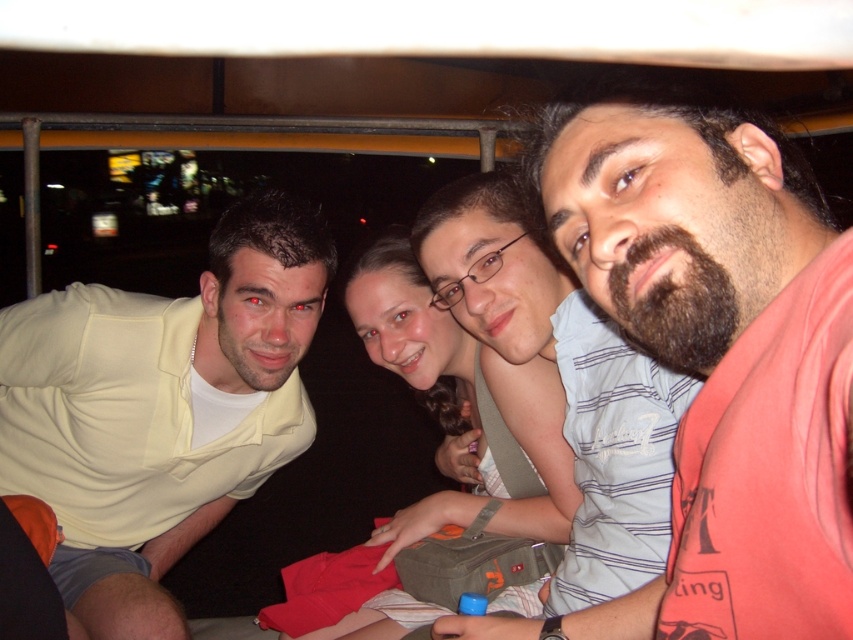
Describe the element at coordinates (715, 356) in the screenshot. I see `bearded man at center` at that location.

Who is more forward, [798,364] or [567,458]?

Positioned in front is point [798,364].

Is point (784, 556) more distant than point (422, 529)?

No, (784, 556) is closer to viewer.

What are the coordinates of `bearded man at center` in the screenshot? It's located at (715, 356).

Is light yellow shirt at left further to the viewer compared to smooth beige shirt at center?

No.

Between point (158, 563) and point (358, 317), which one is positioned in front?

Point (358, 317)

Between point (107, 573) and point (560, 470), which one is positioned in front?

Positioned in front is point (560, 470).

At what (x,y) coordinates should I click in order to perform the action: click on light yellow shirt at left. Please return your answer as a coordinate pair (x, y). Looking at the image, I should click on (161, 408).

Locate an element on the screen. This screenshot has height=640, width=853. bearded man at center is located at coordinates (715, 356).

Which of these two, bearded man at center or light yellow shirt at left, stands shorter?

bearded man at center is shorter.

At what (x,y) coordinates should I click in order to perform the action: click on bearded man at center. Please return your answer as a coordinate pair (x, y). The width and height of the screenshot is (853, 640). Looking at the image, I should click on (715, 356).